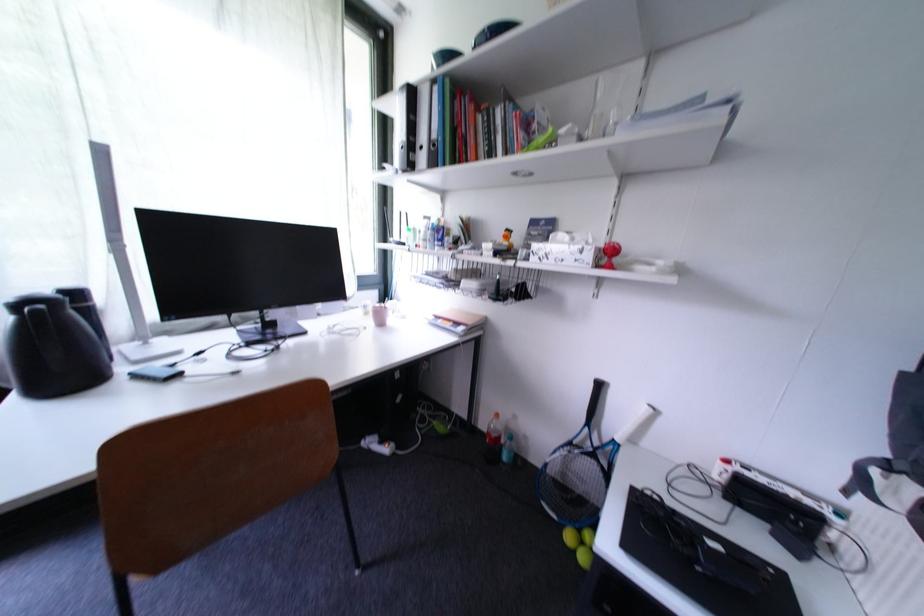
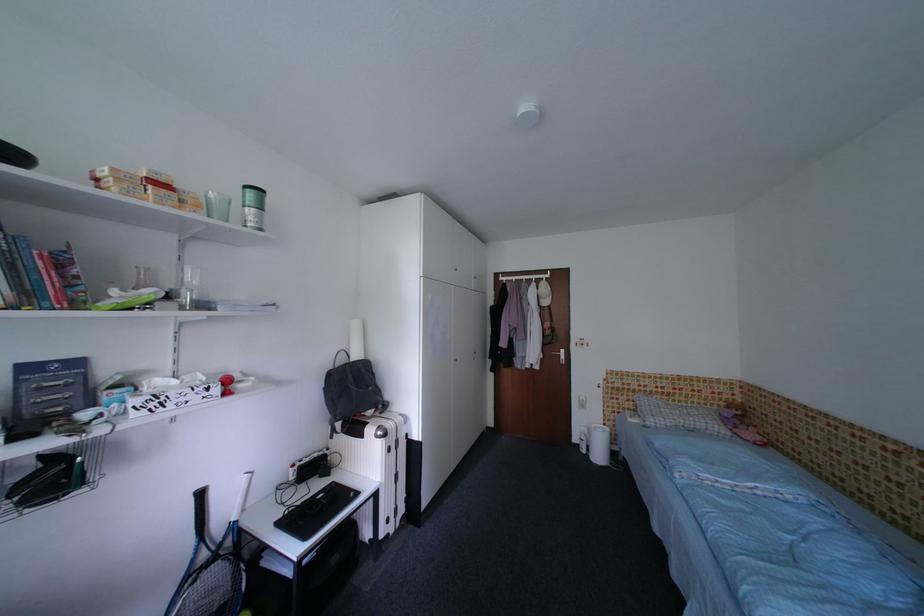
Question: The first image is from the beginning of the video and the second image is from the end. How did the camera likely rotate when shooting the video?

Choices:
 (A) Left
 (B) Right
 (C) Up
 (D) Down

Answer: (B)